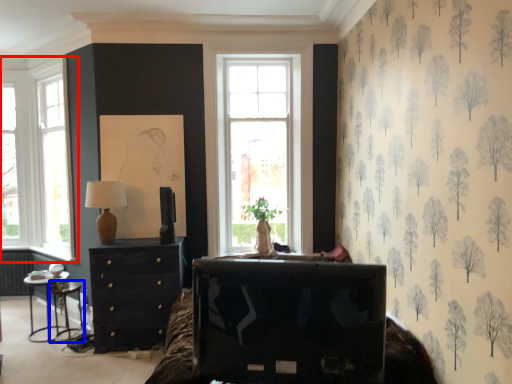
Question: Which object is closer to the camera taking this photo, window (highlighted by a red box) or side table (highlighted by a blue box)?

Choices:
 (A) window
 (B) side table

Answer: (B)